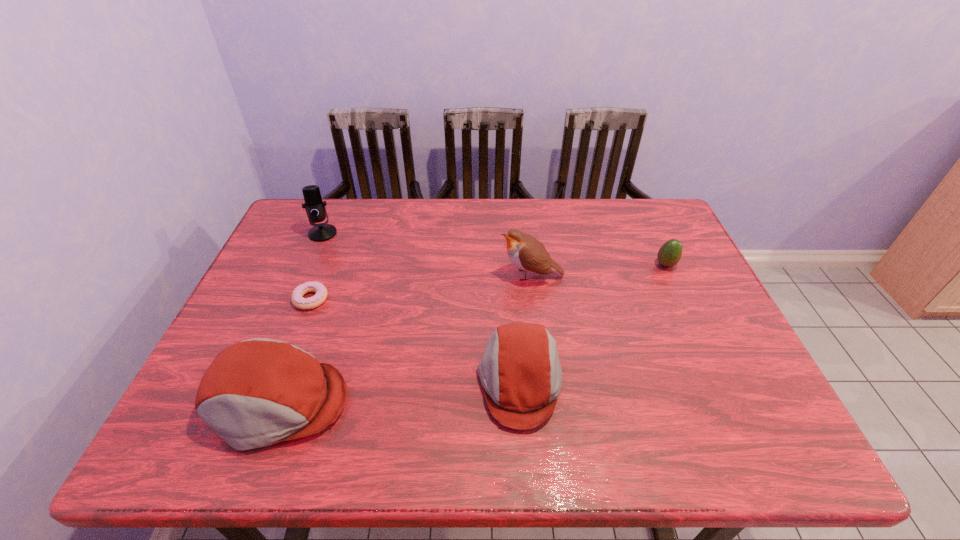
The image size is (960, 540). I want to click on free location located on the front-facing side of the shorter cap, so click(359, 382).

You are a GUI agent. You are given a task and a screenshot of the screen. Output one action in this format:
    pyautogui.click(x=<x>, y=<y>)
    Task: Click on the vacant point located 0.060m on the stand of the farthest object
    
    Given the screenshot: What is the action you would take?
    pyautogui.click(x=314, y=254)

Identify the location of vacant space located 0.250m at the face of the bird. (411, 275).

You are a GUI agent. You are given a task and a screenshot of the screen. Output one action in this format:
    pyautogui.click(x=<x>, y=<y>)
    Task: Click on the vacant area located at the face of the bird
    The image size is (960, 540).
    Given the screenshot: What is the action you would take?
    pyautogui.click(x=474, y=275)

This screenshot has width=960, height=540. I want to click on free space located at the face of the bird, so click(440, 275).

Image resolution: width=960 pixels, height=540 pixels. Identify the location of free space located 0.240m on the left of the rightmost object. tap(573, 265).

You are a GUI agent. You are given a task and a screenshot of the screen. Output one action in this format:
    pyautogui.click(x=<x>, y=<y>)
    Task: Click on the vacant space located 0.130m on the back of the doughnut
    
    Given the screenshot: What is the action you would take?
    pyautogui.click(x=327, y=257)

Identify the location of object that is at the far edge. The image size is (960, 540). (315, 208).

Where is `cap located in the left edge section of the desktop`? This screenshot has height=540, width=960. cap located in the left edge section of the desktop is located at coordinates (259, 392).

This screenshot has height=540, width=960. What are the coordinates of `microphone situated at the left edge` in the screenshot? It's located at pyautogui.click(x=315, y=208).